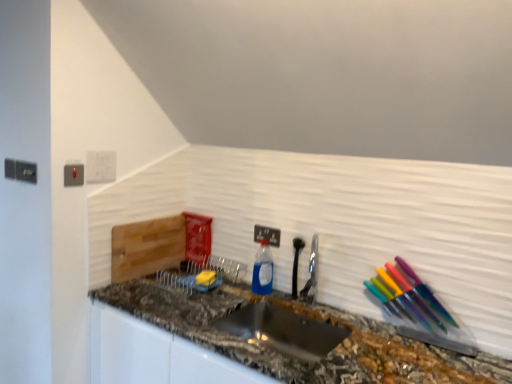
Question: Is point (x=253, y=291) positioned closer to the camera than point (x=108, y=170)?

Choices:
 (A) closer
 (B) farther

Answer: (B)

Question: Choose the correct answer: Is blue translucent bottle at center inside white plastic light switch at upper left or outside it?

Choices:
 (A) inside
 (B) outside

Answer: (B)

Question: Estimate the real-world distances between objects in this image. Which object is closer to the satin nickel faucet at center?

Choices:
 (A) matte gray electric outlet at upper left, arranged as the first electric outlet when viewed from the top
 (B) marble granite countertop at center
 (C) blue translucent bottle at center
 (D) white plastic electric outlet at center, the 2th electric outlet when ordered from front to back
 (E) stainless steel sink at center

Answer: (C)

Question: Estimate the real-world distances between objects in this image. Which object is farther from the stainless steel sink at center?

Choices:
 (A) white plastic electric outlet at center, placed as the second electric outlet when sorted from top to bottom
 (B) white plastic light switch at upper left
 (C) marble granite countertop at center
 (D) matte gray electric outlet at upper left, which appears as the 1th electric outlet when viewed from the left
 (E) blue translucent bottle at center

Answer: (D)